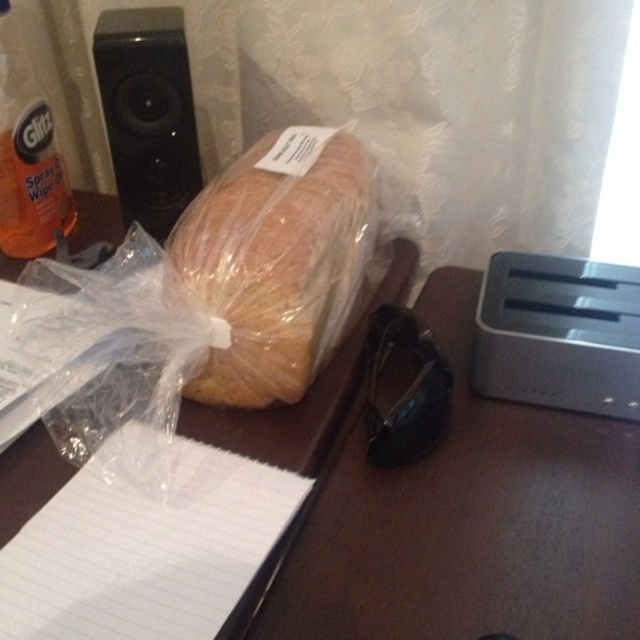
Is point (296, 154) in front of point (124, 157)?

That is True.

Is point (243, 204) positioned behind point (148, 200)?

No, it is not.

The image size is (640, 640). In order to click on translucent plastic bread at center in this screenshot , I will do `click(278, 260)`.

Does clear plastic bread at center appear on the right side of white lined paper at lower left?

Yes, clear plastic bread at center is to the right of white lined paper at lower left.

Is clear plastic bread at center further to camera compared to white lined paper at lower left?

That is True.

Which is in front, point (593, 561) or point (234, 476)?

Point (593, 561) is in front.

Locate an element on the screen. clear plastic bread at center is located at coordinates (445, 504).

Is point (52, 522) positioned behind point (76, 216)?

No, it is in front of (76, 216).

Is point (288, 477) behind point (29, 256)?

No, it is not.

This screenshot has width=640, height=640. In order to click on white lined paper at lower left in this screenshot , I will do pos(147,552).